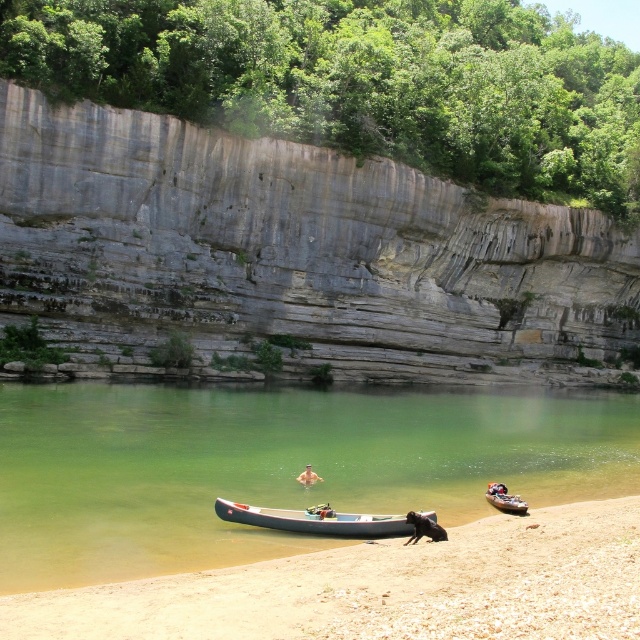
Question: Can you confirm if brown sandy beach at lower center is bigger than wooden canoe at lower right?

Choices:
 (A) yes
 (B) no

Answer: (A)

Question: Which point is closer to the camera?

Choices:
 (A) green translucent water at lower center
 (B) wooden canoe at lower right
 (C) gray rock cliff at upper center

Answer: (A)

Question: Estimate the real-world distances between objects in this image. Which object is closer to the wooden canoe at lower right?

Choices:
 (A) green translucent water at lower center
 (B) gray rubber canoe at center
 (C) brown sandy beach at lower center
 (D) gray rock cliff at upper center

Answer: (C)

Question: Is the position of brown sandy beach at lower center less distant than that of smooth tan skin at center?

Choices:
 (A) no
 (B) yes

Answer: (B)

Question: Which point is farther from the camera taking this photo?

Choices:
 (A) (572, 212)
 (B) (305, 484)
 (C) (403, 522)
 (D) (513, 502)

Answer: (A)

Question: Does green translucent water at lower center appear under gray rubber canoe at center?

Choices:
 (A) no
 (B) yes

Answer: (A)